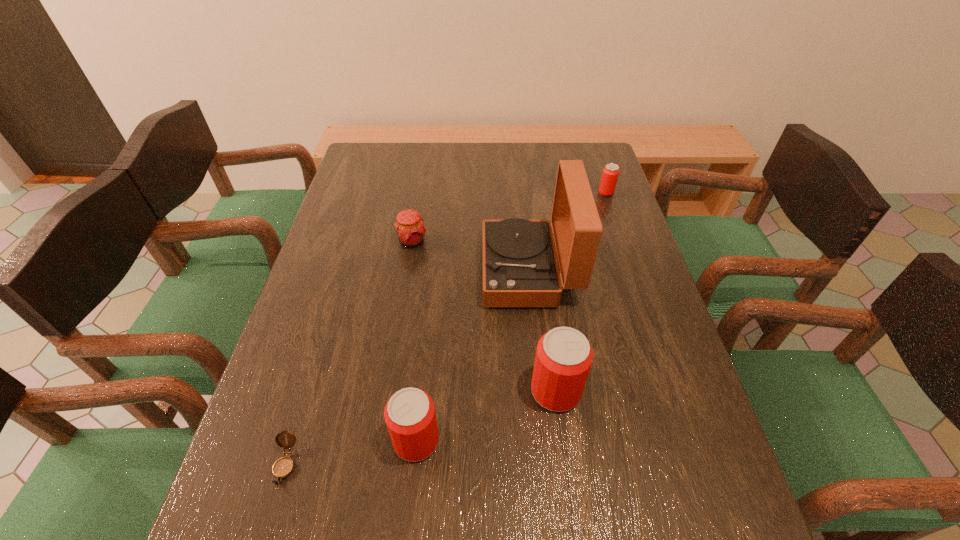
Where is `the leftmost beer can`? The image size is (960, 540). the leftmost beer can is located at coordinates tap(410, 416).

The image size is (960, 540). Identify the location of the third tallest object. (410, 416).

Find the location of a particular element. The image size is (960, 540). the tallest beer can is located at coordinates (564, 356).

Image resolution: width=960 pixels, height=540 pixels. In order to click on the second beer can from left to right in this screenshot , I will do `click(564, 356)`.

The width and height of the screenshot is (960, 540). I want to click on jam, so click(409, 225).

Find the location of a particular element. the farthest object is located at coordinates (610, 174).

You are a GUI agent. You are given a task and a screenshot of the screen. Output one action in this format:
    pyautogui.click(x=<x>, y=<y>)
    Task: Click on the shortest beer can
    Image resolution: width=960 pixels, height=540 pixels.
    Given the screenshot: What is the action you would take?
    pyautogui.click(x=610, y=174)

You are a GUI agent. You are given a task and a screenshot of the screen. Output one action in this format:
    pyautogui.click(x=<x>, y=<y>)
    Task: Click on the tallest object
    
    Given the screenshot: What is the action you would take?
    pyautogui.click(x=519, y=263)

Where is `the shortest object`? the shortest object is located at coordinates tap(283, 467).

Image resolution: width=960 pixels, height=540 pixels. Identify the location of compass. (283, 467).